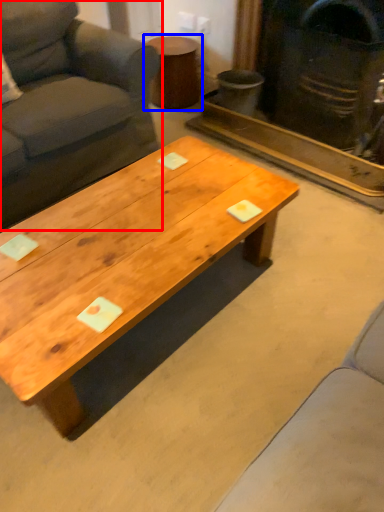
Question: Which object appears farthest to the camera in this image, studio couch (highlighted by a red box) or side table (highlighted by a blue box)?

Choices:
 (A) studio couch
 (B) side table

Answer: (B)